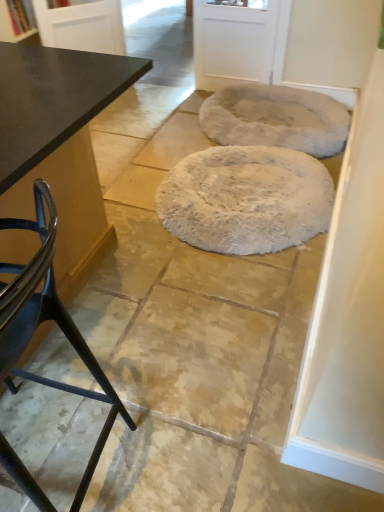
Where is `vacant area that is situated to the right of black matte table at left`? vacant area that is situated to the right of black matte table at left is located at coordinates (208, 354).